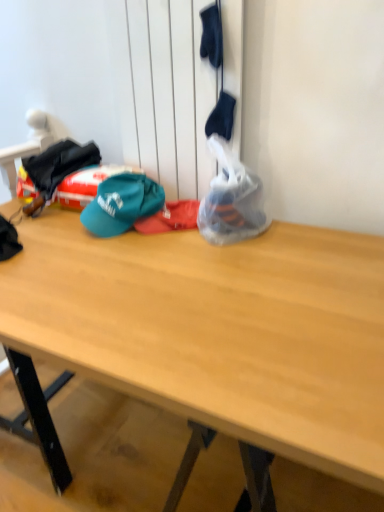
Question: From the image's perspective, is translucent plastic bag at center above or below wooden desk at center?

Choices:
 (A) below
 (B) above

Answer: (B)

Question: From a real-world perspective, is translucent plastic bag at center physically located above or below wooden desk at center?

Choices:
 (A) above
 (B) below

Answer: (A)

Question: Estimate the real-world distances between objects in this image. Which object is farther from the translucent plastic bag at center?

Choices:
 (A) teal fabric cap at center
 (B) wooden desk at center

Answer: (B)

Question: Estimate the real-world distances between objects in this image. Which object is farther from the wooden desk at center?

Choices:
 (A) translucent plastic bag at center
 (B) teal fabric cap at center

Answer: (B)